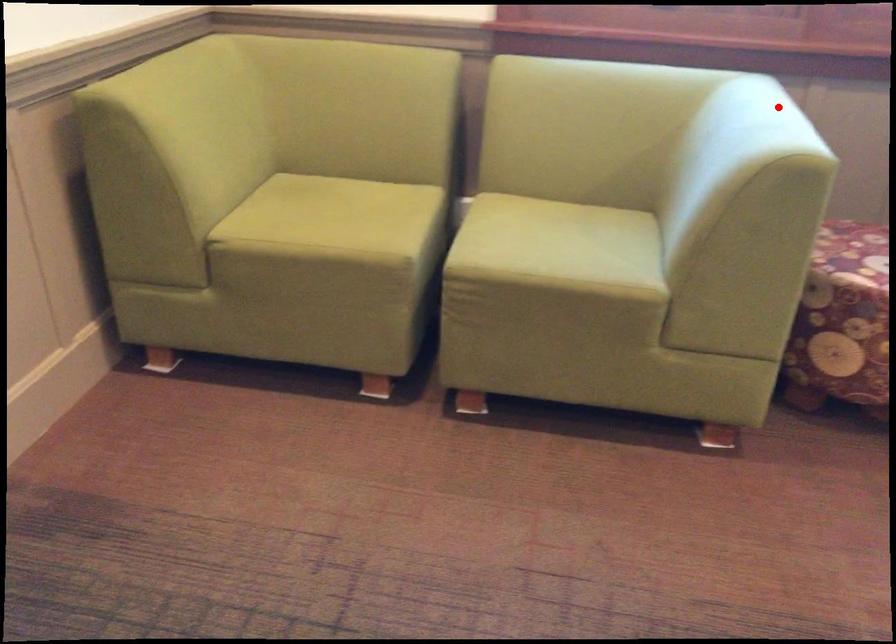
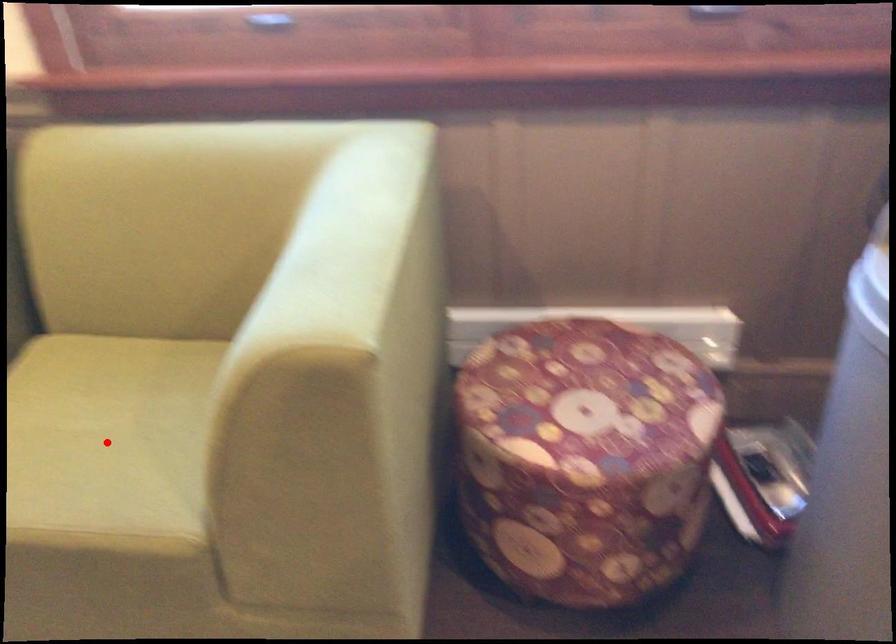
I am providing you with two images of the same scene from different viewpoints. A red point is marked on the first image and another point is marked on the second image. Is the marked point in image1 the same physical position as the marked point in image2?

No